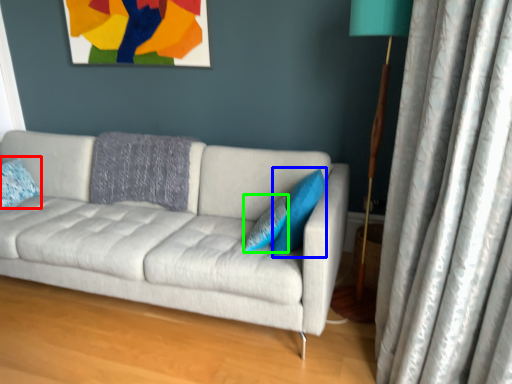
Question: Which is nearer to the pillow (highlighted by a red box)? pillow (highlighted by a blue box) or pillow (highlighted by a green box).

Choices:
 (A) pillow
 (B) pillow

Answer: (B)